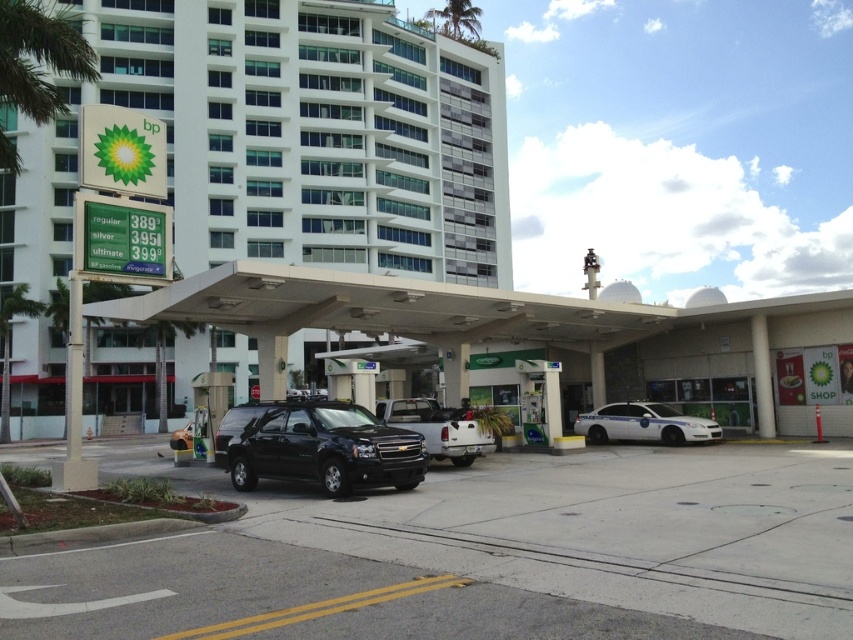
Question: Among these points, which one is nearest to the camera?

Choices:
 (A) (708, 429)
 (B) (7, 358)
 (C) (399, 404)

Answer: (C)

Question: Is white concrete parking garage at center wider than green leafy palm tree at left?

Choices:
 (A) yes
 (B) no

Answer: (A)

Question: Which point appears closest to the camera in this image?

Choices:
 (A) (311, 212)
 (B) (25, 291)
 (C) (641, 340)
 (D) (283, 413)

Answer: (D)

Question: Which object is closer to the camera taking this photo?

Choices:
 (A) white glass building at upper center
 (B) green leafy palm tree at upper center
 (C) white glossy police car at center
 (D) matte black suv at center

Answer: (A)

Question: In this image, where is green leafy palm tree at left located relative to green leafy palm tree at upper center?

Choices:
 (A) right
 (B) left

Answer: (B)

Question: Is white glossy police car at center to the right of matte black suv at center from the viewer's perspective?

Choices:
 (A) yes
 (B) no

Answer: (A)